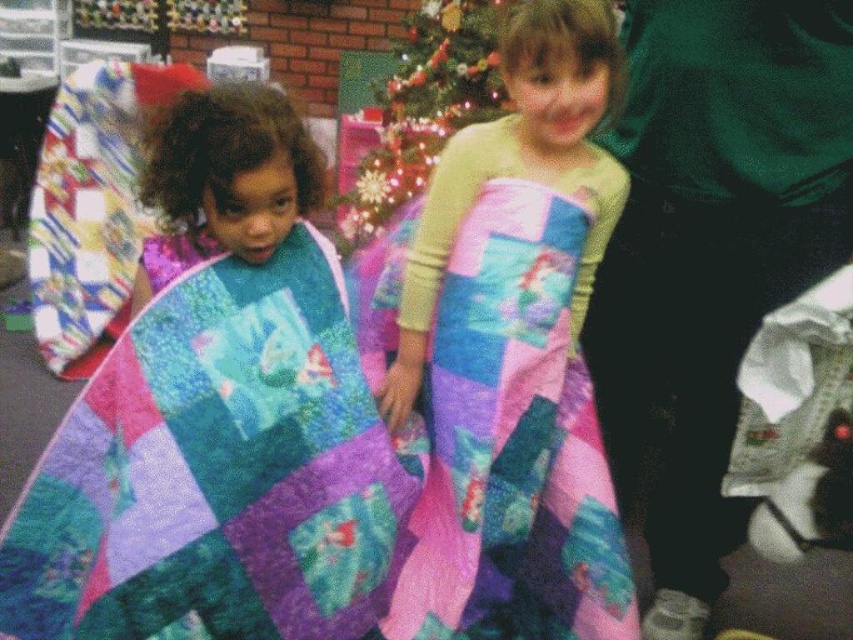
You are a photographer trying to capture both the multicolored quilt at left and the shiny green christmas tree at upper center in a single frame. Based on their sizes, which object will appear smaller in the photo?

The multicolored quilt at left will appear smaller in the photo because it is not as tall as the shiny green christmas tree at upper center.

You are a photographer setting up a shot in this room. You need to decide if the multicolored quilt at left and the shiny green christmas tree at upper center can both fit in your camera frame without moving the camera. The frame can hold objects up to 1.2 meters wide. The quilt is 1.1 meters wide and the tree is 1.0 meters wide. Are both objects within the frame width limit?

The multicolored quilt at left is 1.1 meters wide and the shiny green christmas tree at upper center is 1.0 meters wide. Both are within the 1.2 meter frame width limit, so yes, they can both fit without moving the camera.